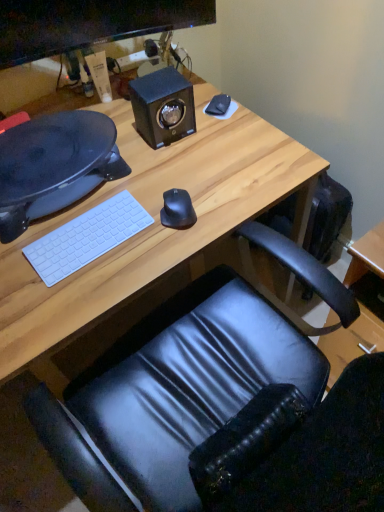
Locate an element on the screen. The width and height of the screenshot is (384, 512). free region under white matte keyboard at lower left (from a real-world perspective) is located at coordinates (91, 242).